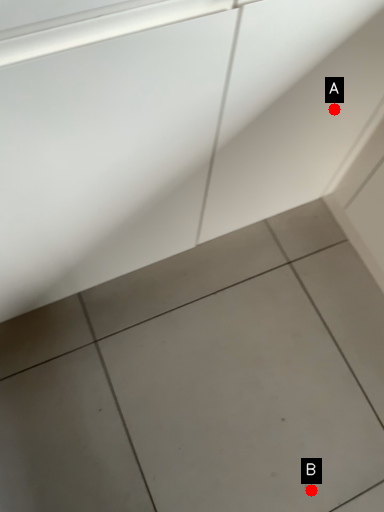
Question: Two points are circled on the image, labeled by A and B beside each circle. Among these points, which one is farthest from the camera?

Choices:
 (A) A is further
 (B) B is further

Answer: (B)